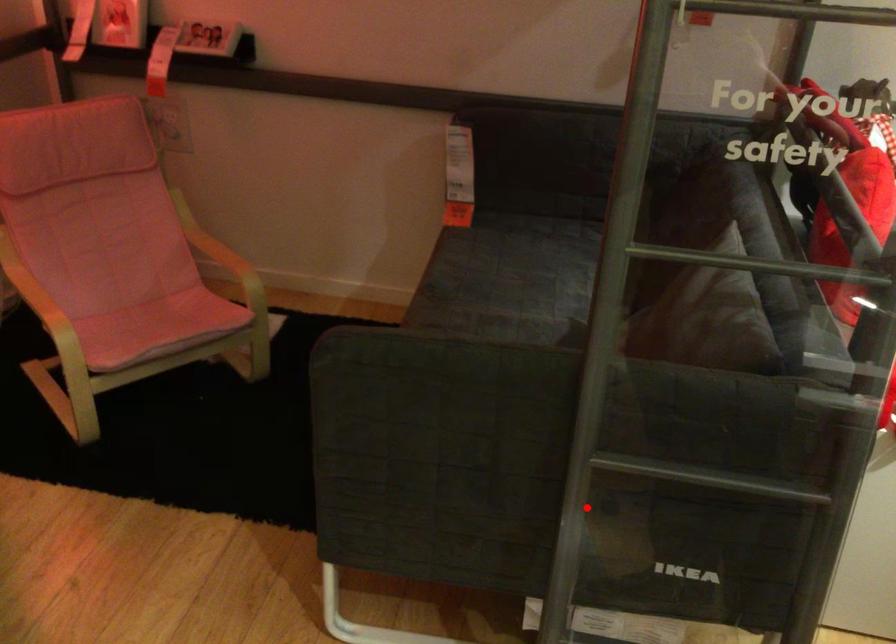
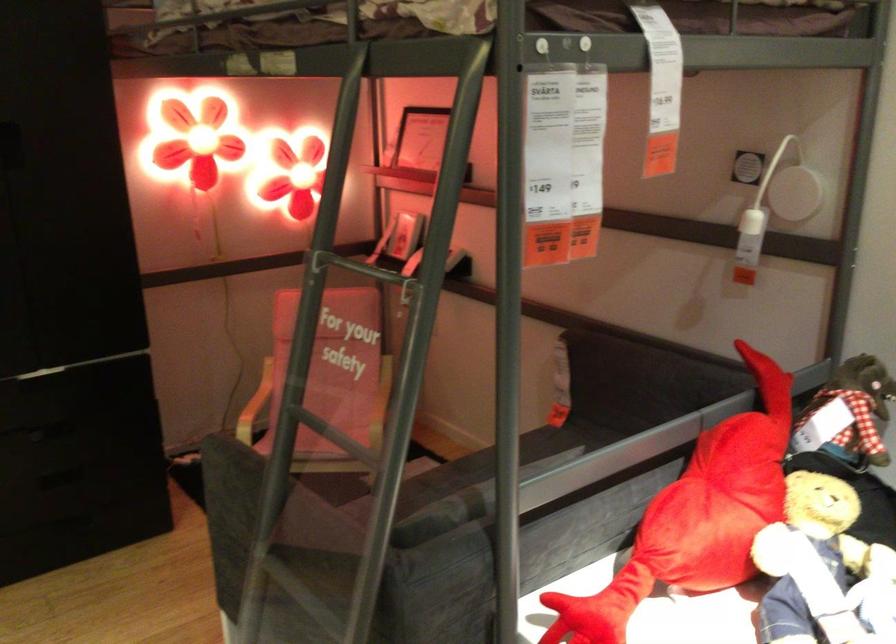
Question: I am providing you with two images of the same scene from different viewpoints. In image1, a red point is highlighted. Considering the same 3D point in image2, which of the following is correct?

Choices:
 (A) It is closer
 (B) It is farther

Answer: (B)